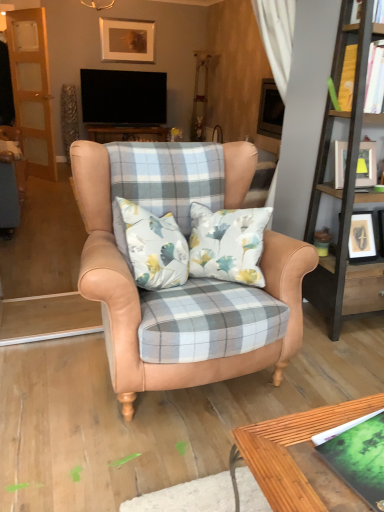
Locate an element on the screen. leather wingback chair at center is located at coordinates (139, 298).

Locate an element on the screen. This screenshot has height=512, width=384. matte gold picture frame at upper center, the second picture frame positioned from the bottom is located at coordinates (127, 40).

From the picture: What is the approximate width of green matte book at lower right, the second book in the top-to-bottom sequence?

green matte book at lower right, the second book in the top-to-bottom sequence, is 12.81 inches wide.

This screenshot has height=512, width=384. What do you see at coordinates (360, 457) in the screenshot?
I see `green matte book at lower right, which appears as the second book when viewed from the back` at bounding box center [360, 457].

You are a GUI agent. You are given a task and a screenshot of the screen. Output one action in this format:
    pyautogui.click(x=<x>, y=<y>)
    Task: Click on the wooden bookshelf at right
    The height and width of the screenshot is (512, 384).
    Given the screenshot: What is the action you would take?
    pyautogui.click(x=343, y=194)

Is green matte book at lower right, which is the first book from front to back, located outside wooden screen door at left?

Yes, green matte book at lower right, which is the first book from front to back, is not within wooden screen door at left.

From a real-world perspective, is green matte book at lower right, arranged as the first book when viewed from the left, located beneath wooden screen door at left?

Yes.

Could you tell me if green matte book at lower right, the 2th book in the right-to-left sequence, is facing wooden screen door at left?

No, green matte book at lower right, the 2th book in the right-to-left sequence, is not turned towards wooden screen door at left.

Which is behind, leather wingback chair at center or wooden bookshelf at right?

wooden bookshelf at right.

Which object is positioned more to the left, leather wingback chair at center or wooden bookshelf at right?

leather wingback chair at center is more to the left.

Which of these two, leather wingback chair at center or wooden bookshelf at right, is wider?

Wider between the two is leather wingback chair at center.

Does leather wingback chair at center have a greater height compared to wooden bookshelf at right?

Incorrect, the height of leather wingback chair at center is not larger of that of wooden bookshelf at right.

Which is closer, (93,217) or (14,87)?

Positioned in front is point (93,217).

From the image's perspective, would you say leather wingback chair at center is shown under wooden screen door at left?

Yes, from the image's perspective, leather wingback chair at center is below wooden screen door at left.

Considering the sizes of objects leather wingback chair at center and wooden screen door at left in the image provided, who is thinner, leather wingback chair at center or wooden screen door at left?

Thinner between the two is wooden screen door at left.

Which object is positioned more to the right, wooden bookshelf at right or leather wingback chair at center?

Positioned to the right is wooden bookshelf at right.

How many degrees apart are the facing directions of wooden bookshelf at right and leather wingback chair at center?

The angle between the facing direction of wooden bookshelf at right and the facing direction of leather wingback chair at center is 1.62 degrees.

Locate an element on the screen. This screenshot has width=384, height=512. bookshelf on the right side of leather wingback chair at center is located at coordinates (343, 194).

Is wooden bookshelf at right spatially inside leather wingback chair at center, or outside of it?

wooden bookshelf at right is not enclosed by leather wingback chair at center.

Can you tell me how much leather wingback chair at center and yellow paper book at upper right, which is counted as the 1th book, starting from the top, differ in facing direction?

leather wingback chair at center and yellow paper book at upper right, which is counted as the 1th book, starting from the top, are facing 0.907 degrees away from each other.

From the image's perspective, which one is positioned higher, leather wingback chair at center or yellow paper book at upper right, which is counted as the 1th book, starting from the top?

yellow paper book at upper right, which is counted as the 1th book, starting from the top, is shown above in the image.

From a real-world perspective, relative to yellow paper book at upper right, which is counted as the second book, starting from the bottom, is leather wingback chair at center vertically above or below?

leather wingback chair at center is below yellow paper book at upper right, which is counted as the second book, starting from the bottom.

Is wooden bookshelf at right at the left side of wooden screen door at left?

No, wooden bookshelf at right is not to the left of wooden screen door at left.

The height and width of the screenshot is (512, 384). I want to click on screen door to the left of wooden bookshelf at right, so [x=32, y=88].

Considering the sizes of objects wooden bookshelf at right and wooden screen door at left in the image provided, who is thinner, wooden bookshelf at right or wooden screen door at left?

Thinner between the two is wooden screen door at left.

Is point (328, 282) behind point (45, 44)?

That is False.

Which object is wider, green matte book at lower right, arranged as the first book when viewed from the left, or wooden bookshelf at right?

Wider between the two is wooden bookshelf at right.

Between green matte book at lower right, the 2th book in the right-to-left sequence, and wooden bookshelf at right, which one has less height?

Standing shorter between the two is green matte book at lower right, the 2th book in the right-to-left sequence.

What's the angular difference between green matte book at lower right, the second book in the top-to-bottom sequence, and wooden bookshelf at right's facing directions?

The facing directions of green matte book at lower right, the second book in the top-to-bottom sequence, and wooden bookshelf at right are 78.9 degrees apart.

Is green matte book at lower right, the 2th book in the right-to-left sequence, completely or partially outside of wooden bookshelf at right?

Yes, green matte book at lower right, the 2th book in the right-to-left sequence, is outside of wooden bookshelf at right.

The height and width of the screenshot is (512, 384). What are the coordinates of `screen door above the green matte book at lower right, the second book in the top-to-bottom sequence (from a real-world perspective)` in the screenshot? It's located at (32, 88).

Identify the location of chair below the wooden bookshelf at right (from the image's perspective). This screenshot has width=384, height=512. (139, 298).

Looking at the image, which one is located further to wooden screen door at left, wooden bookshelf at right or matte white picture frame at upper right, the 2th picture frame when ordered from left to right?

matte white picture frame at upper right, the 2th picture frame when ordered from left to right, lies further to wooden screen door at left than the other object.

Looking at the image, which one is located further to wooden screen door at left, leather wingback chair at center or green matte book at lower right, the 2th book in the right-to-left sequence?

The object further to wooden screen door at left is green matte book at lower right, the 2th book in the right-to-left sequence.

Which object lies nearer to the anchor point matte white picture frame at upper right, which is the 2th picture frame in back-to-front order, wooden bookshelf at right or matte gold picture frame at upper center, which appears as the 2th picture frame when viewed from the front?

wooden bookshelf at right is positioned closer to the anchor matte white picture frame at upper right, which is the 2th picture frame in back-to-front order.

From the image, which object appears to be nearer to yellow paper book at upper right, which is counted as the first book, starting from the back, wooden bookshelf at right or wooden screen door at left?

wooden bookshelf at right.

Which object lies further to the anchor point matte gold picture frame at upper center, arranged as the first picture frame when viewed from the left, green matte book at lower right, which is the first book from front to back, or wooden screen door at left?

Based on the image, green matte book at lower right, which is the first book from front to back, appears to be further to matte gold picture frame at upper center, arranged as the first picture frame when viewed from the left.

Estimate the real-world distances between objects in this image. Which object is closer to leather wingback chair at center, yellow paper book at upper right, the 2th book in the left-to-right sequence, or matte white picture frame at upper right, arranged as the second picture frame when viewed from the top?

Among the two, matte white picture frame at upper right, arranged as the second picture frame when viewed from the top, is located nearer to leather wingback chair at center.

Based on their spatial positions, is leather wingback chair at center or yellow paper book at upper right, which is counted as the first book, starting from the back, closer to matte gold picture frame at upper center, which appears as the 2th picture frame when viewed from the front?

The object closer to matte gold picture frame at upper center, which appears as the 2th picture frame when viewed from the front, is yellow paper book at upper right, which is counted as the first book, starting from the back.

Consider the image. Based on their spatial positions, is wooden bookshelf at right or wooden screen door at left further from matte gold picture frame at upper center, which appears as the 2th picture frame when viewed from the front?

Among the two, wooden bookshelf at right is located further to matte gold picture frame at upper center, which appears as the 2th picture frame when viewed from the front.

Where is `picture frame between yellow paper book at upper right, marked as the first book in a right-to-left arrangement, and matte gold picture frame at upper center, marked as the 1th picture frame in a back-to-front arrangement, in the front-back direction`? The height and width of the screenshot is (512, 384). picture frame between yellow paper book at upper right, marked as the first book in a right-to-left arrangement, and matte gold picture frame at upper center, marked as the 1th picture frame in a back-to-front arrangement, in the front-back direction is located at coordinates (366, 165).

This screenshot has width=384, height=512. I want to click on bookshelf between leather wingback chair at center and wooden screen door at left from front to back, so click(343, 194).

At what (x,y) coordinates should I click in order to perform the action: click on picture frame between leather wingback chair at center and yellow paper book at upper right, the 2th book positioned from the front, in the horizontal direction. Please return your answer as a coordinate pair (x, y). The width and height of the screenshot is (384, 512). Looking at the image, I should click on (366, 165).

At what (x,y) coordinates should I click in order to perform the action: click on book located between green matte book at lower right, which appears as the second book when viewed from the back, and wooden screen door at left in the depth direction. Please return your answer as a coordinate pair (x, y). This screenshot has width=384, height=512. Looking at the image, I should click on (374, 76).